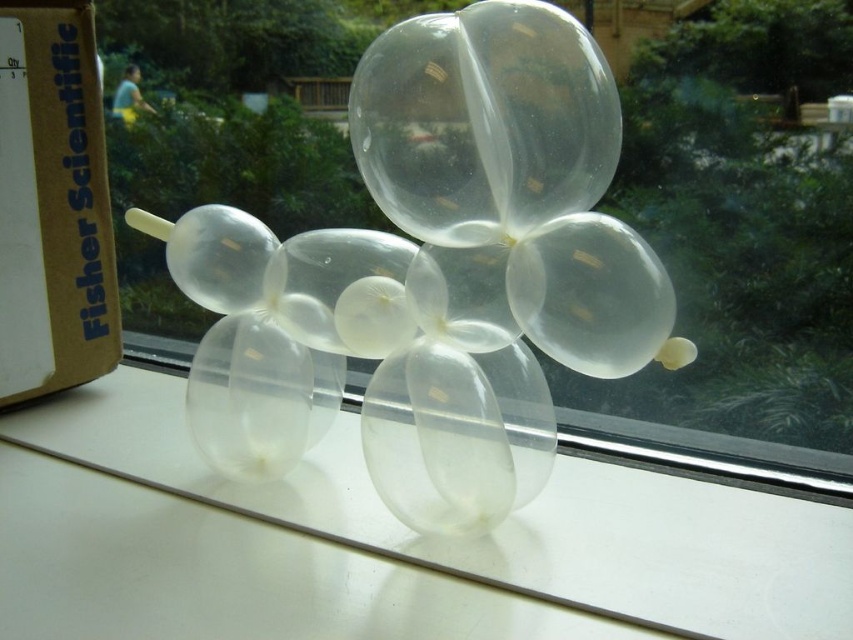
What do you see at coordinates (436, 273) in the screenshot? Image resolution: width=853 pixels, height=640 pixels. I see `transparent plastic balloon at center` at bounding box center [436, 273].

Can you confirm if transparent plastic balloon at center is positioned above transparent plastic table at center?

Yes.

The width and height of the screenshot is (853, 640). What are the coordinates of `transparent plastic balloon at center` in the screenshot? It's located at (436, 273).